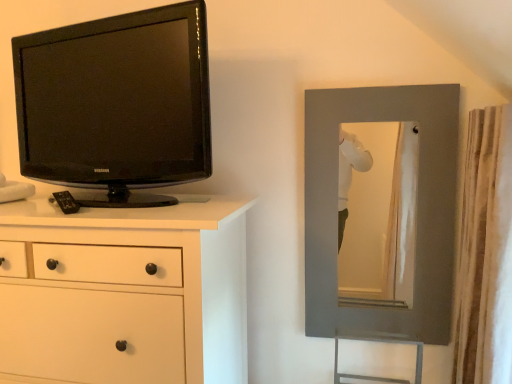
Question: Is white textured curtain at right at the left side of white matte chest of drawers at left?

Choices:
 (A) yes
 (B) no

Answer: (B)

Question: Does white textured curtain at right come in front of white matte chest of drawers at left?

Choices:
 (A) no
 (B) yes

Answer: (B)

Question: Could you tell me if white textured curtain at right is turned towards white matte chest of drawers at left?

Choices:
 (A) no
 (B) yes

Answer: (B)

Question: Does white textured curtain at right have a lesser width compared to white matte chest of drawers at left?

Choices:
 (A) no
 (B) yes

Answer: (B)

Question: Is white textured curtain at right behind white matte chest of drawers at left?

Choices:
 (A) yes
 (B) no

Answer: (B)

Question: Considering the relative sizes of white textured curtain at right and white matte chest of drawers at left in the image provided, is white textured curtain at right wider than white matte chest of drawers at left?

Choices:
 (A) yes
 (B) no

Answer: (B)

Question: Is white textured curtain at right at the right side of black glossy tv at left?

Choices:
 (A) yes
 (B) no

Answer: (A)

Question: Would you say black glossy tv at left is part of white textured curtain at right's contents?

Choices:
 (A) yes
 (B) no

Answer: (B)

Question: Does white textured curtain at right have a greater width compared to black glossy tv at left?

Choices:
 (A) no
 (B) yes

Answer: (B)

Question: From the image's perspective, is white textured curtain at right under black glossy tv at left?

Choices:
 (A) no
 (B) yes

Answer: (B)

Question: From the image's perspective, is white textured curtain at right on black glossy tv at left?

Choices:
 (A) yes
 (B) no

Answer: (B)

Question: From a real-world perspective, is white textured curtain at right below black glossy tv at left?

Choices:
 (A) yes
 (B) no

Answer: (A)

Question: Is matte gray mirror at right bigger than white textured curtain at right?

Choices:
 (A) yes
 (B) no

Answer: (B)